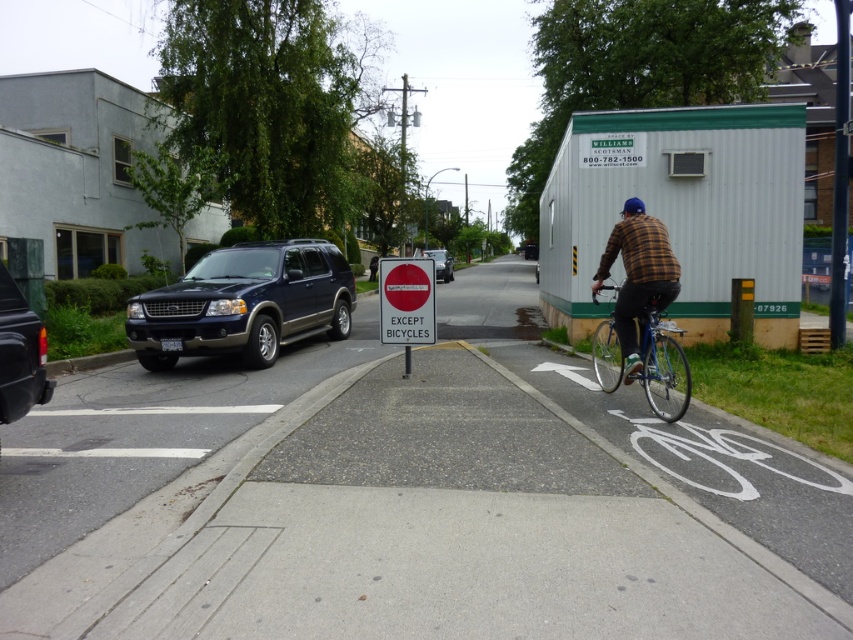
Question: Is shiny dark blue suv at left closer to camera compared to brown plaid shirt at right?

Choices:
 (A) no
 (B) yes

Answer: (A)

Question: Observing the image, what is the correct spatial positioning of brown plaid shirt at right in reference to red plastic sign at center?

Choices:
 (A) right
 (B) left

Answer: (A)

Question: Does matte black suv at left come in front of matte black suv at center?

Choices:
 (A) yes
 (B) no

Answer: (A)

Question: Among these points, which one is nearest to the camera?

Choices:
 (A) (662, 365)
 (B) (428, 250)
 (C) (410, 339)
 (D) (42, 355)

Answer: (D)

Question: Which of the following is the farthest from the observer?

Choices:
 (A) matte black suv at center
 (B) red plastic sign at center

Answer: (A)

Question: Which point appears closest to the camera in this image?

Choices:
 (A) (447, 259)
 (B) (403, 284)
 (C) (659, 332)

Answer: (C)